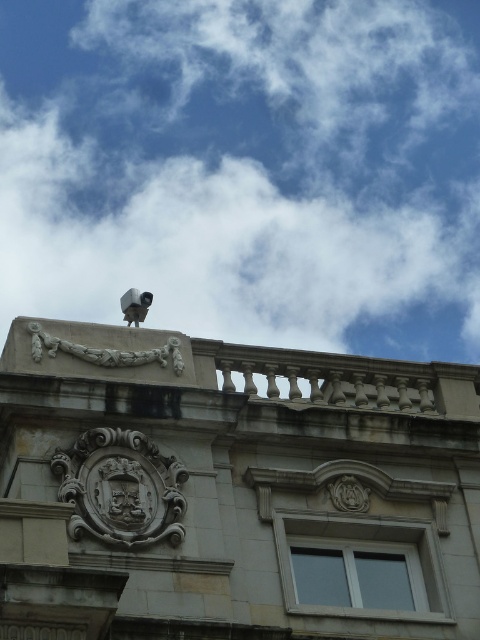
You are an architect reviewing the building facade. You notice the white fluffy cloud at upper center and the white stone sculpture at upper center. Which object appears closer to you?

The white fluffy cloud at upper center appears closer because it is in front of the white stone sculpture at upper center.

You are an architect reviewing the building design. You notice the white fluffy cloud at upper center and the white stone sculpture at upper center. Which one is higher in the scene?

The white fluffy cloud at upper center is positioned over white stone sculpture at upper center, so the cloud is higher than the sculpture.